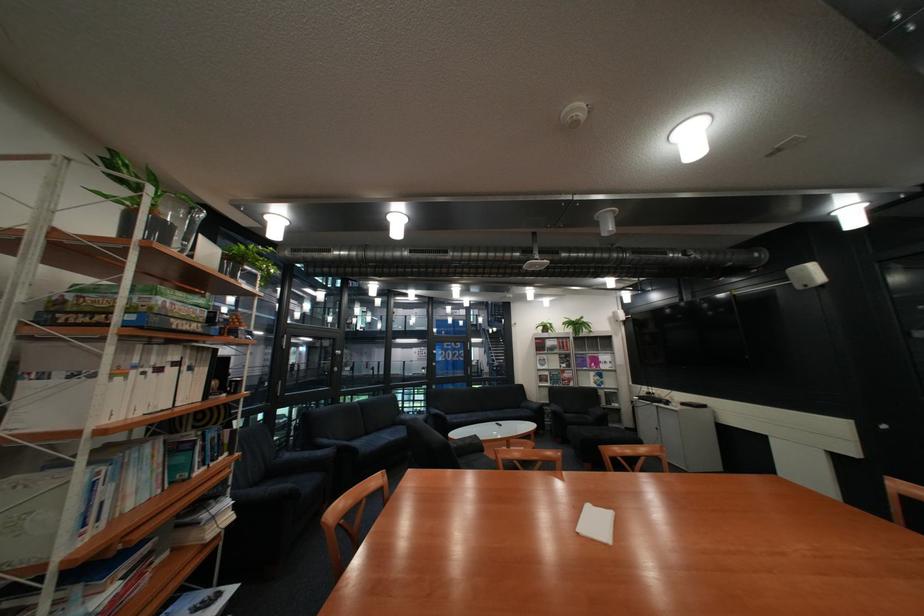
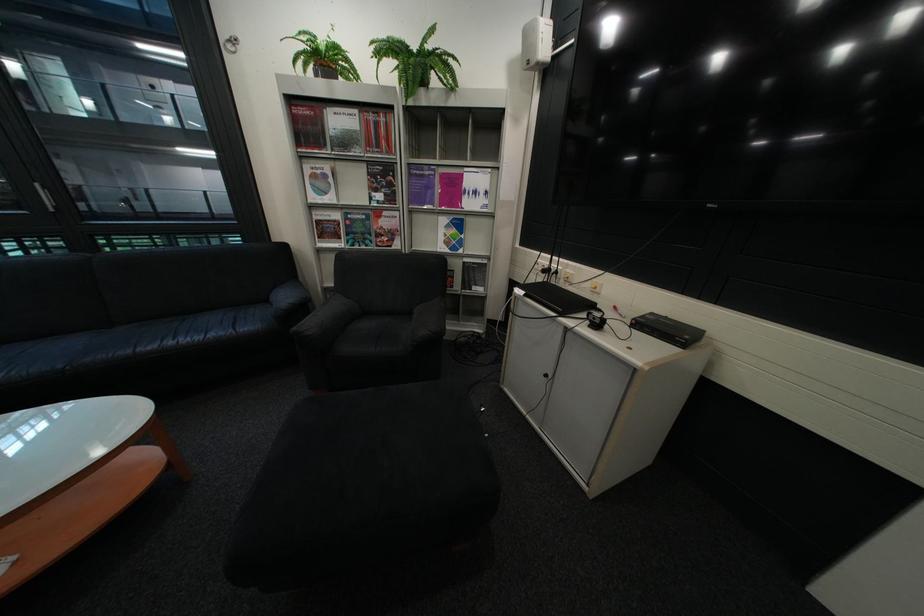
Where in the second image is the point corresponding to point 585,363 from the first image?

(409, 192)